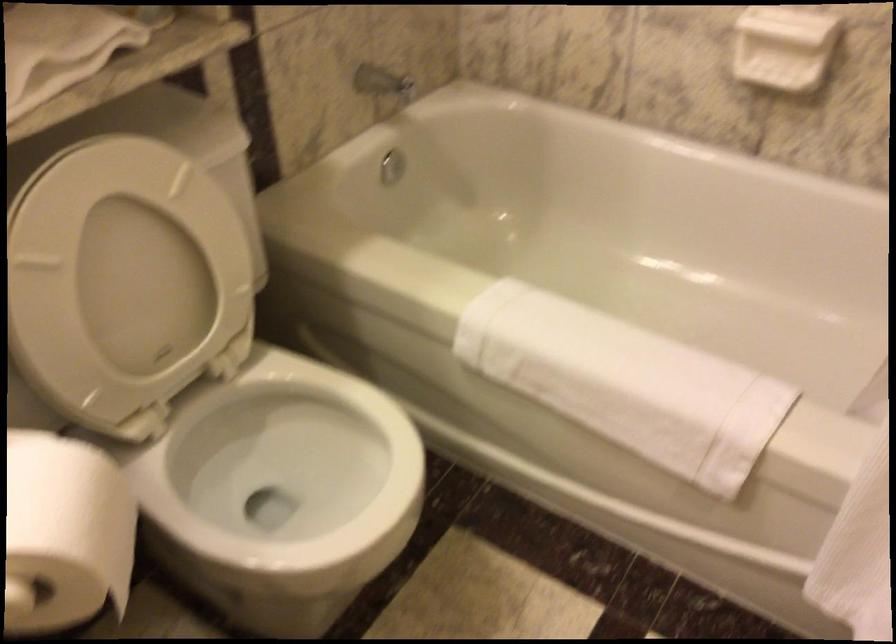
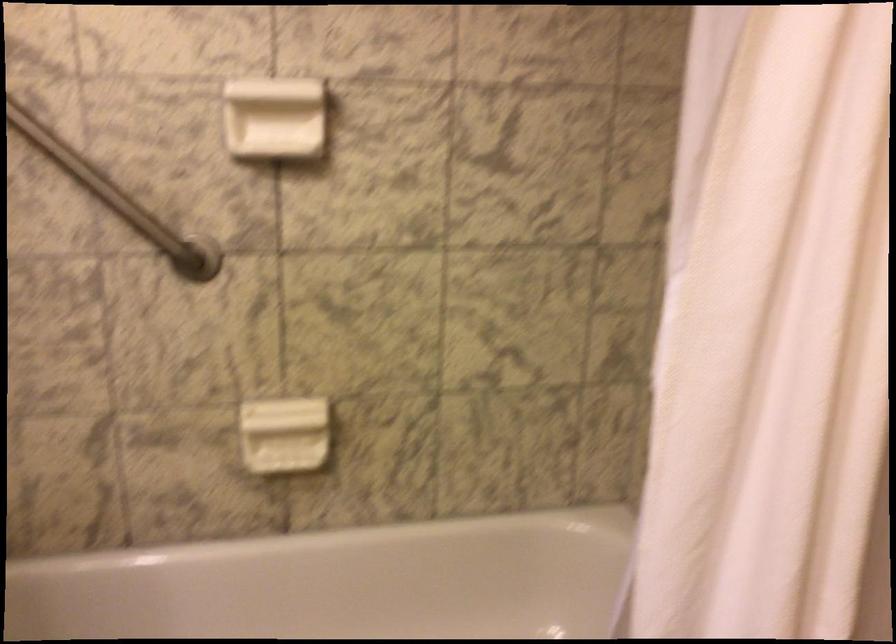
Question: Based on the continuous images, in which direction is the camera rotating? Reply with the corresponding letter.

Choices:
 (A) Left
 (B) Right
 (C) Up
 (D) Down

Answer: (B)